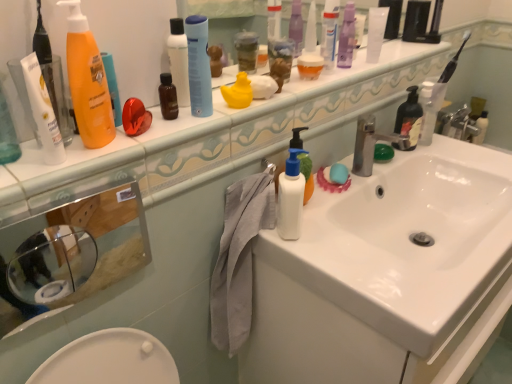
The image size is (512, 384). I want to click on vacant space behind blue matte soap at sink, so click(346, 163).